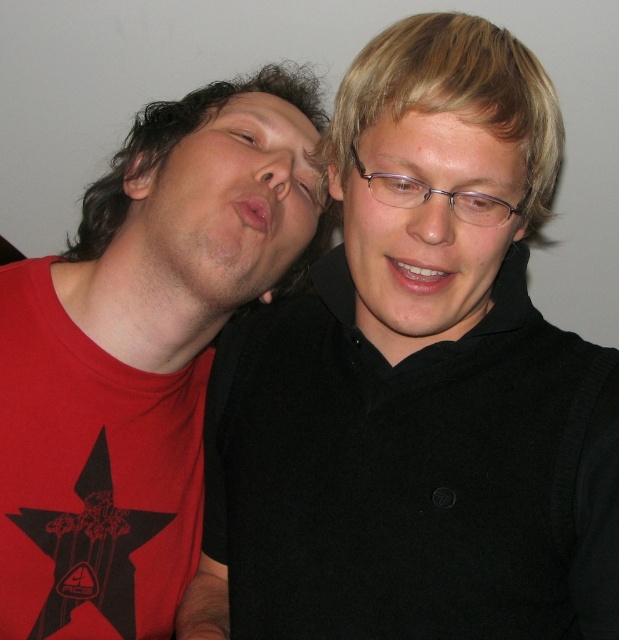
You are a photographer setting up for a portrait shoot. You notice the black matte shirt at upper left and the matte black glasses at center in the frame. Which object should you adjust to ensure both are clearly visible without one blocking the other?

The black matte shirt at upper left is in front of the matte black glasses at center, so you should adjust the position of the black matte shirt at upper left to move it out of the way so the matte black glasses at center can be seen clearly.

You are a photographer trying to capture the perfect shot of the two people in the scene. You want to ensure that the black matte shirt at upper left is visible in the frame. Where should you position your camera relative to the point at coordinates (x=422, y=385) to include the black matte shirt at upper left in the photo?

The black matte shirt at upper left is located at the point (x=422, y=385), so positioning the camera directly at that coordinate will ensure the black matte shirt at upper left is visible in the frame.

You are an architect designing a new building and need to place two important landmarks at the coordinates provided. The first landmark must be placed at point (441, 17) and the second at point (170, 577). Which landmark will appear closer to visitors entering the building from the front?

Point (441, 17) is closer to the viewer than point (170, 577), so the first landmark placed at point (441, 17) will appear closer to visitors entering the building from the front.